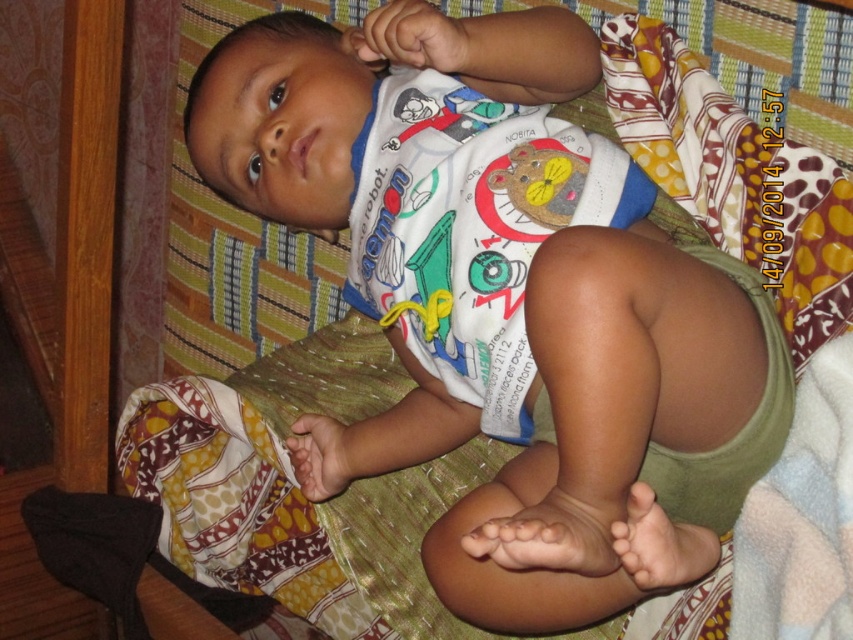
Can you confirm if white cotton onesie at center is shorter than white cotton bib at center?

No.

Which is in front, point (654, 257) or point (474, 326)?

Point (654, 257) is more forward.

Where is `white cotton onesie at center`? This screenshot has height=640, width=853. white cotton onesie at center is located at coordinates (505, 300).